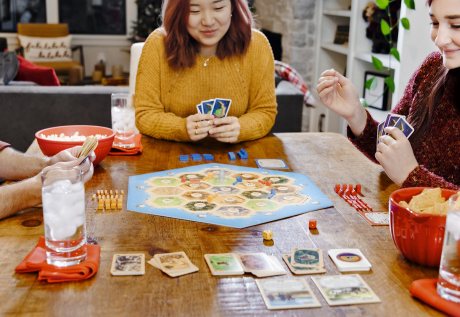
The image size is (460, 317). I want to click on glass of water, so click(x=59, y=245), click(x=63, y=226), click(x=63, y=213), click(x=452, y=260), click(x=452, y=238).